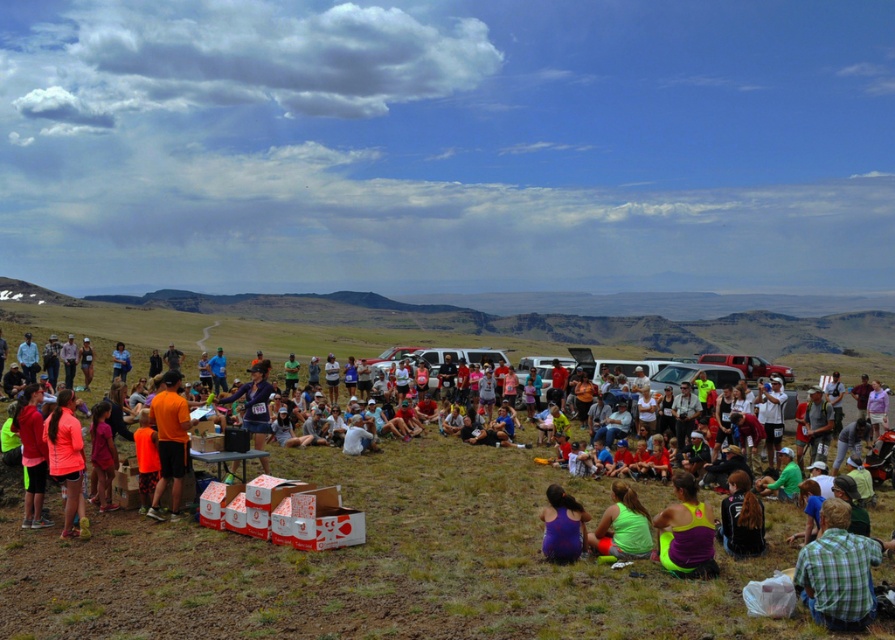
Question: Which point is closer to the camera?

Choices:
 (A) neon green tank top at lower center
 (B) green matte tank top at lower center
 (C) green plaid shirt at lower right

Answer: (C)

Question: Is neon green tank top at lower center closer to camera compared to purple fabric at center?

Choices:
 (A) yes
 (B) no

Answer: (A)

Question: Which point appears farthest from the camera in this image?

Choices:
 (A) tap(625, 513)
 (B) tap(849, 572)
 (C) tap(544, 550)
 (D) tap(646, 563)

Answer: (A)

Question: Does neon green tank top at lower center appear on the left side of purple fabric at center?

Choices:
 (A) no
 (B) yes

Answer: (A)

Question: Among these points, which one is nearest to the camera?

Choices:
 (A) (580, 541)
 (B) (597, 529)
 (C) (60, 480)

Answer: (A)

Question: Does neon pink fabric at center have a lesser width compared to shiny purple jacket at lower right?

Choices:
 (A) yes
 (B) no

Answer: (A)